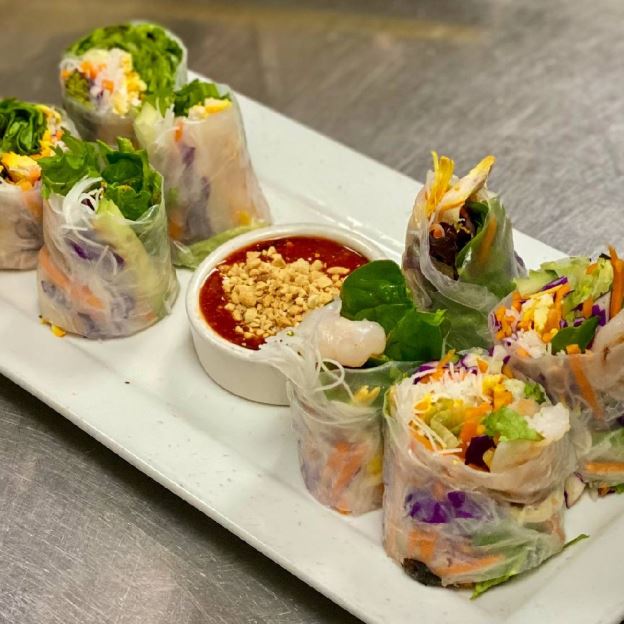
Image resolution: width=624 pixels, height=624 pixels. What are the coordinates of `rectangular white platter` in the screenshot? It's located at (232, 427).